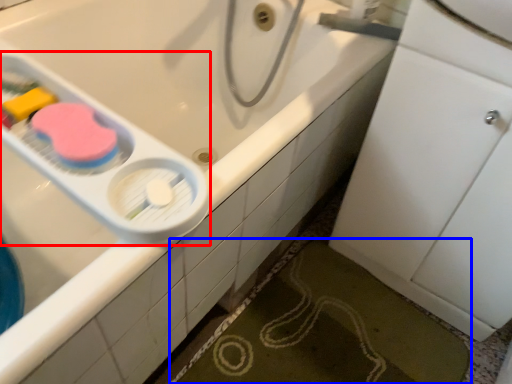
Question: Which of the following is the closest to the observer, scale (highlighted by a red box) or bath mat (highlighted by a blue box)?

Choices:
 (A) scale
 (B) bath mat

Answer: (A)